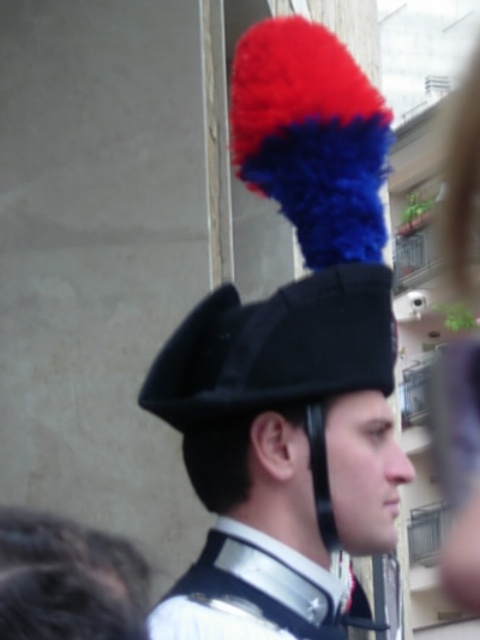
Is black felt hat at center further to camera compared to black felt hat at upper center?

No, it is not.

Is point (355, 316) positioned behind point (284, 392)?

That is True.

Find the location of a particular element. black felt hat at center is located at coordinates click(286, 404).

The width and height of the screenshot is (480, 640). What do you see at coordinates (276, 348) in the screenshot? I see `black felt hat at upper center` at bounding box center [276, 348].

Which of these two, black felt hat at upper center or white glossy uniform at center, stands shorter?

black felt hat at upper center

The image size is (480, 640). Identify the location of black felt hat at upper center. (276, 348).

Which is behind, point (294, 397) or point (212, 556)?

The point (212, 556) is more distant.

Can you confirm if black felt hat at center is positioned above white glossy uniform at center?

Indeed, black felt hat at center is positioned over white glossy uniform at center.

Who is more distant from viewer, (206, 484) or (236, 608)?

The point (206, 484) is behind.

Find the location of `black felt hat at center`. black felt hat at center is located at coordinates (286, 404).